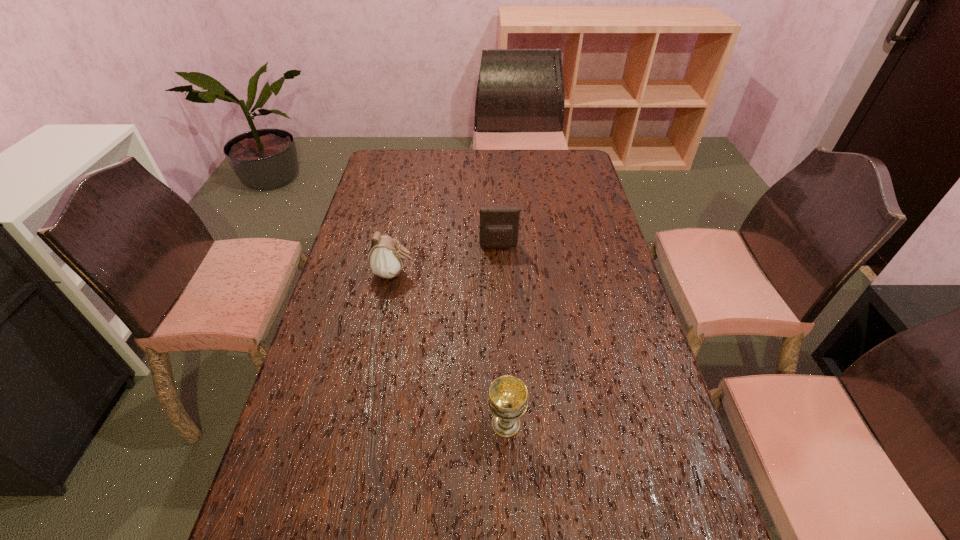
In order to click on the right pouch in this screenshot , I will do `click(499, 224)`.

You are a GUI agent. You are given a task and a screenshot of the screen. Output one action in this format:
    pyautogui.click(x=<x>, y=<y>)
    Task: Click on the farthest object
    
    Given the screenshot: What is the action you would take?
    pyautogui.click(x=499, y=224)

Find the location of a particular element. the second farthest object is located at coordinates (x=386, y=256).

Image resolution: width=960 pixels, height=540 pixels. I want to click on the left pouch, so click(386, 256).

I want to click on the nearest object, so click(508, 396).

The height and width of the screenshot is (540, 960). I want to click on vacant space positioned with an open flap on the farther pouch, so tap(501, 290).

The width and height of the screenshot is (960, 540). Find the location of `vacant area located 0.260m on the front-facing side of the second farthest object`. vacant area located 0.260m on the front-facing side of the second farthest object is located at coordinates (497, 273).

Find the location of a particular element. The width and height of the screenshot is (960, 540). free space located 0.330m on the left of the nearest object is located at coordinates (346, 424).

At what (x,y) coordinates should I click in order to perform the action: click on object at the left edge. Please return your answer as a coordinate pair (x, y). Image resolution: width=960 pixels, height=540 pixels. Looking at the image, I should click on (386, 256).

The width and height of the screenshot is (960, 540). Identify the location of free space at the far edge of the desktop. (484, 165).